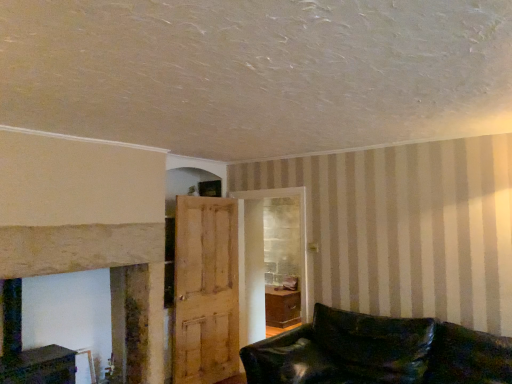
Question: Can you confirm if leather couch at lower right is shorter than light brown wooden door at center?

Choices:
 (A) no
 (B) yes

Answer: (B)

Question: Can you confirm if leather couch at lower right is thinner than light brown wooden door at center?

Choices:
 (A) no
 (B) yes

Answer: (A)

Question: From a real-world perspective, is leather couch at lower right beneath light brown wooden door at center?

Choices:
 (A) yes
 (B) no

Answer: (A)

Question: Can you confirm if leather couch at lower right is taller than light brown wooden door at center?

Choices:
 (A) no
 (B) yes

Answer: (A)

Question: Is leather couch at lower right in contact with light brown wooden door at center?

Choices:
 (A) no
 (B) yes

Answer: (A)

Question: Is leather couch at lower right looking in the opposite direction of light brown wooden door at center?

Choices:
 (A) yes
 (B) no

Answer: (B)

Question: From a real-world perspective, is smooth stone fireplace at left over leather couch at lower right?

Choices:
 (A) yes
 (B) no

Answer: (A)

Question: Is smooth stone fireplace at left touching leather couch at lower right?

Choices:
 (A) yes
 (B) no

Answer: (B)

Question: From the image's perspective, is smooth stone fireplace at left beneath leather couch at lower right?

Choices:
 (A) no
 (B) yes

Answer: (A)

Question: Considering the relative sizes of smooth stone fireplace at left and leather couch at lower right in the image provided, is smooth stone fireplace at left bigger than leather couch at lower right?

Choices:
 (A) yes
 (B) no

Answer: (A)

Question: Is smooth stone fireplace at left closer to the viewer compared to leather couch at lower right?

Choices:
 (A) no
 (B) yes

Answer: (A)

Question: Does smooth stone fireplace at left turn towards leather couch at lower right?

Choices:
 (A) yes
 (B) no

Answer: (A)

Question: Does light brown wooden door at center come in front of smooth stone fireplace at left?

Choices:
 (A) no
 (B) yes

Answer: (A)